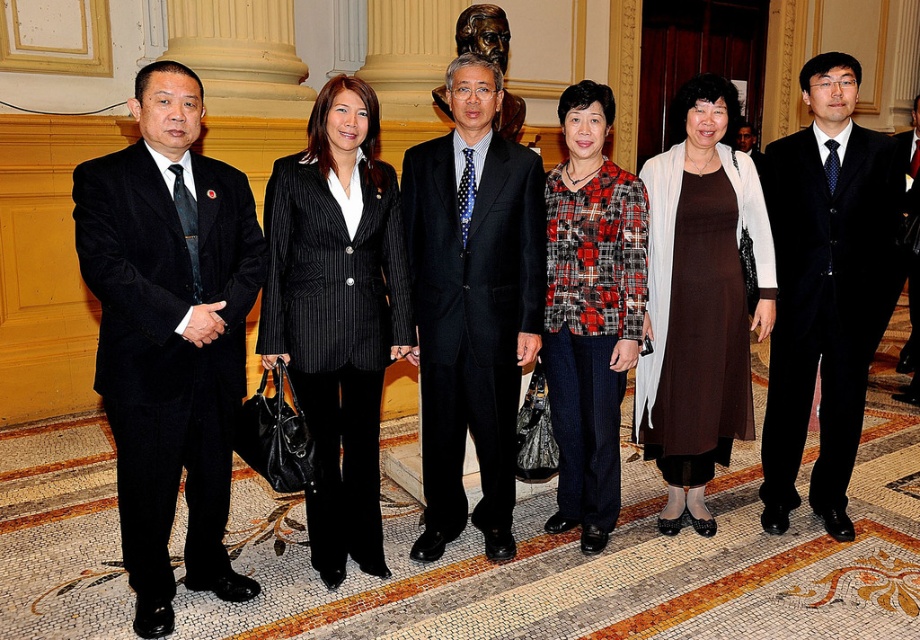
Question: Can you confirm if velvet black suit at center is wider than plaid fabric jacket at center?

Choices:
 (A) no
 (B) yes

Answer: (B)

Question: Among these points, which one is farthest from the camera?

Choices:
 (A) (123, 406)
 (B) (714, 284)
 (C) (575, 422)
 (D) (497, 316)

Answer: (C)

Question: Does velvet black suit at center appear over brown matte dress at center?

Choices:
 (A) no
 (B) yes

Answer: (B)

Question: Which is nearer to the velvet black suit at center?

Choices:
 (A) polka dot tie at center
 (B) plaid fabric jacket at center
 (C) brown matte dress at center

Answer: (C)

Question: Estimate the real-world distances between objects in this image. Which object is closer to the plaid fabric jacket at center?

Choices:
 (A) brown matte dress at center
 (B) black pinstripe suit at center
 (C) polka dot tie at center
 (D) velvet black suit at center

Answer: (C)

Question: Where is black wool suit at left located in relation to polka dot tie at center in the image?

Choices:
 (A) below
 (B) above

Answer: (A)